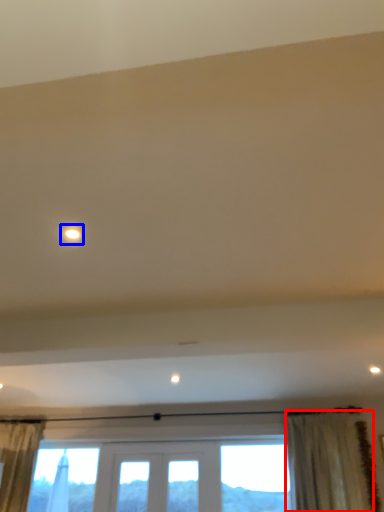
Question: Which object appears closest to the camera in this image, curtain (highlighted by a red box) or light (highlighted by a blue box)?

Choices:
 (A) curtain
 (B) light

Answer: (B)